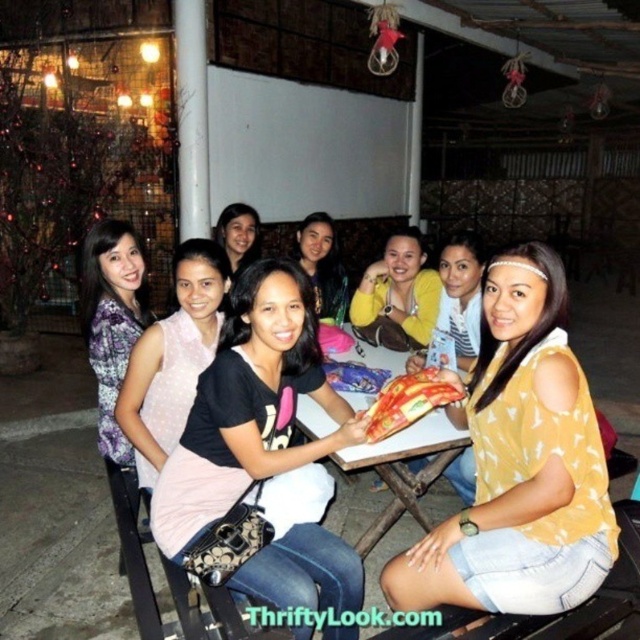
You are a photographer trying to adjust the composition of this photo. Since both the black cotton shirt at center and the matte black dress at center are in the frame, which one is more visible to you?

The black cotton shirt at center is more visible because it is in front of the matte black dress at center.

You are standing at the center of the table where the women are seated. You want to reach a snack packet located at point (173, 458) and then move to another point (189, 250). Which path should you take first to reach the snack packet before the other point?

You should first go towards point (173, 458) because it is in front of point (189, 250), making it closer to your starting position at the center of the table.

You are a photographer trying to capture a closeup of the matte black dress at center and the plaid fabric blouse at left. Which one is on the right side when viewed from the photographer perspective?

The matte black dress at center is positioned on the right side of plaid fabric blouse at left, so the matte black dress at center is on the right side from the photographer perspective.